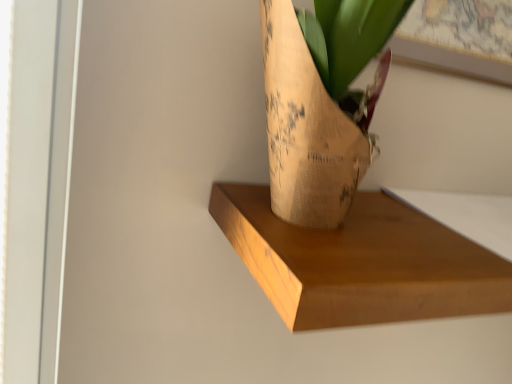
What is the approximate width of wooden shelf at center?

The width of wooden shelf at center is 30.59 centimeters.

The width and height of the screenshot is (512, 384). Describe the element at coordinates (361, 262) in the screenshot. I see `wooden shelf at center` at that location.

Find the location of a particular element. wooden shelf at center is located at coordinates (361, 262).

I want to click on wooden shelf at center, so click(x=361, y=262).